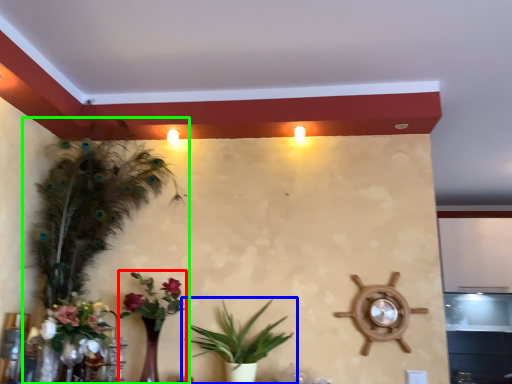
Question: Which object is positioned farthest from floral arrangement (highlighted by a red box)? Select from houseplant (highlighted by a blue box) and houseplant (highlighted by a green box).

Choices:
 (A) houseplant
 (B) houseplant

Answer: (B)